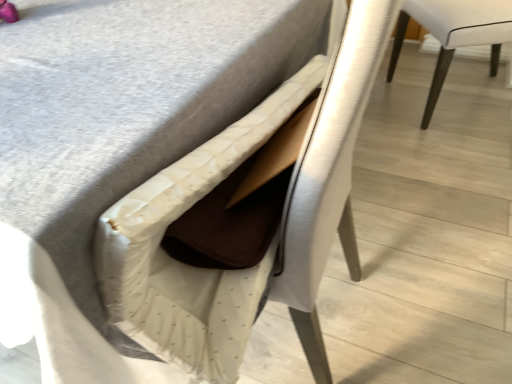
Describe the element at coordinates (454, 34) in the screenshot. The image size is (512, 384). I see `white leather chair at upper right` at that location.

This screenshot has width=512, height=384. I want to click on white leather chair at upper right, so click(x=454, y=34).

Find the location of a particular element. white leather chair at upper right is located at coordinates (454, 34).